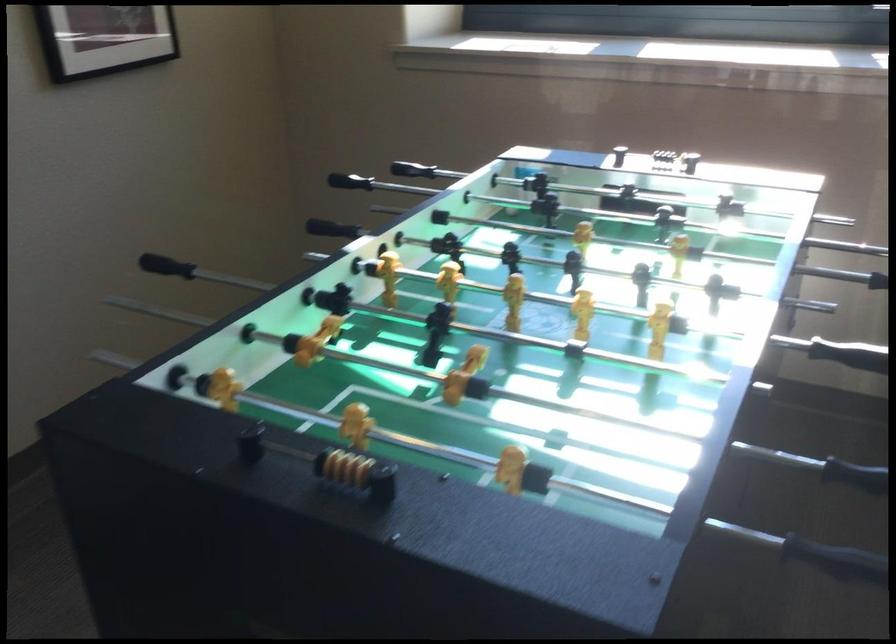
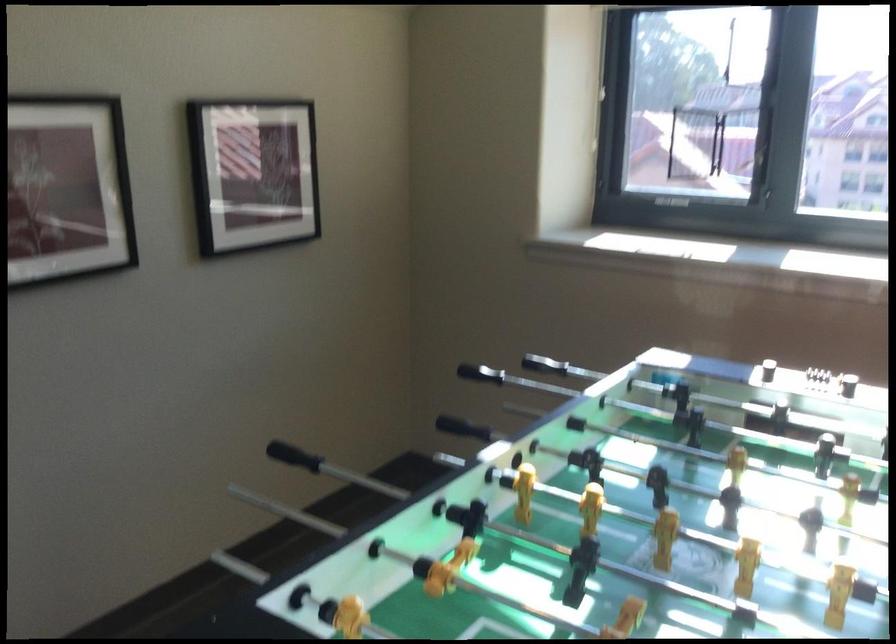
The point at [179,285] is marked in the first image. Where is the corresponding point in the second image?

(294, 456)